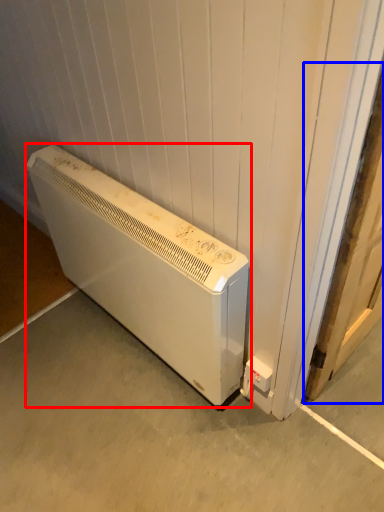
Question: Which object is closer to the camera taking this photo, home appliance (highlighted by a red box) or door (highlighted by a blue box)?

Choices:
 (A) home appliance
 (B) door

Answer: (B)